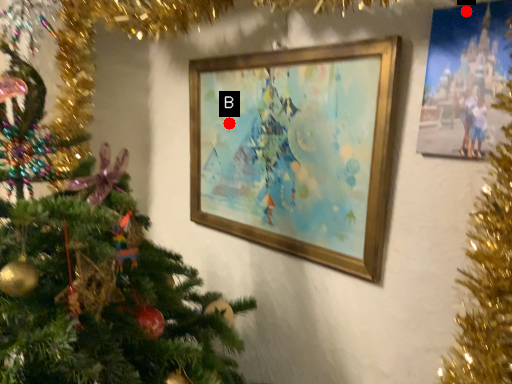
Question: Two points are circled on the image, labeled by A and B beside each circle. Which point is closer to the camera?

Choices:
 (A) A is closer
 (B) B is closer

Answer: (A)